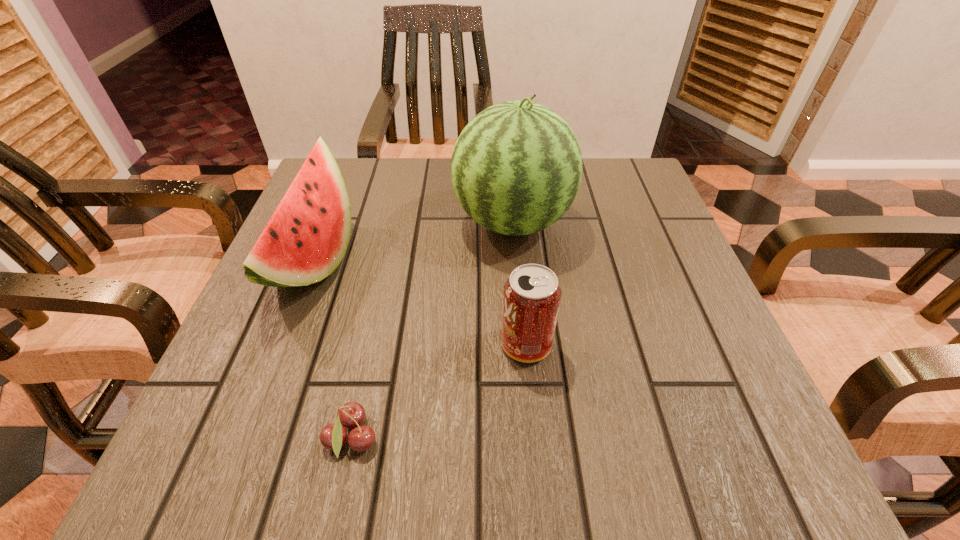
Locate an element on the screen. The height and width of the screenshot is (540, 960). free region located 0.180m on the leaves of the shortest object is located at coordinates (511, 440).

This screenshot has height=540, width=960. Identify the location of object that is at the near edge. (333, 436).

What are the coordinates of `object situated at the left edge` in the screenshot? It's located at (306, 238).

Locate an element on the screen. Image resolution: width=960 pixels, height=540 pixels. object that is at the far left corner is located at coordinates (306, 238).

The width and height of the screenshot is (960, 540). In order to click on free space at the far edge in this screenshot , I will do `click(444, 175)`.

You are a GUI agent. You are given a task and a screenshot of the screen. Output one action in this format:
    pyautogui.click(x=<x>, y=<y>)
    Task: Click on the vacant space at the near edge of the desktop
    The image size is (960, 540).
    Given the screenshot: What is the action you would take?
    pyautogui.click(x=592, y=462)

The height and width of the screenshot is (540, 960). In the image, there is a desktop. In order to click on vacant space at the left edge in this screenshot , I will do `click(239, 377)`.

Where is `vacant space at the right edge`? This screenshot has height=540, width=960. vacant space at the right edge is located at coordinates (611, 264).

Where is `vacant region at the far left corner`? The height and width of the screenshot is (540, 960). vacant region at the far left corner is located at coordinates pos(348,168).

I want to click on vacant space at the far right corner of the desktop, so click(x=625, y=196).